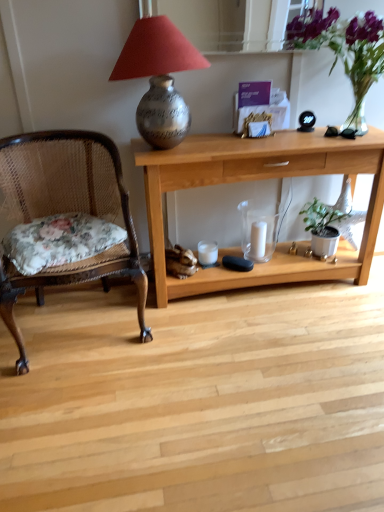
This screenshot has height=512, width=384. I want to click on vacant space underneath silver textured vase at upper center (from a real-world perspective), so click(174, 147).